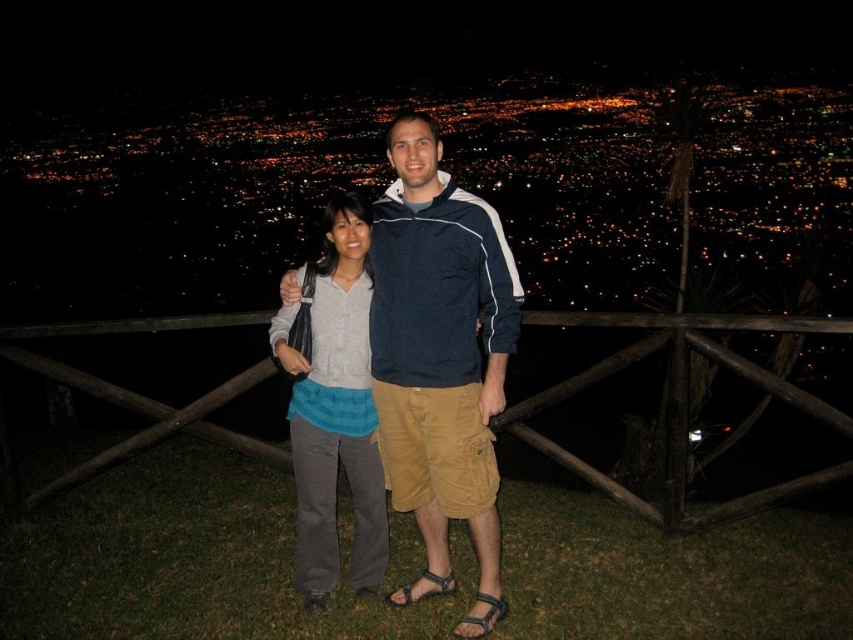
You are taking a photo of the two people in the scene. You want to focus on the person closer to the front. Which point should you use for auto focus? Please choose between point (480, 371) and point (843, 321).

Point (480, 371) is closer to the viewer than point (843, 321), so you should use point (480, 371) for auto focus to focus on the person closer to the front.

You are a photographer trying to focus on the blue cotton shirt at center. Based on their positions, which direction should you move the camera focus point to align with the shirt?

The blue cotton shirt at center is located at point (440, 346), so you should move the focus point slightly to the right and down to align with it.

You are a photographer adjusting the camera settings to focus on the blue cotton shirt at center. What is the exact coordinate where you should aim the camera?

The blue cotton shirt at center is located at point [440,346], so you should aim the camera at those coordinates to focus on it.